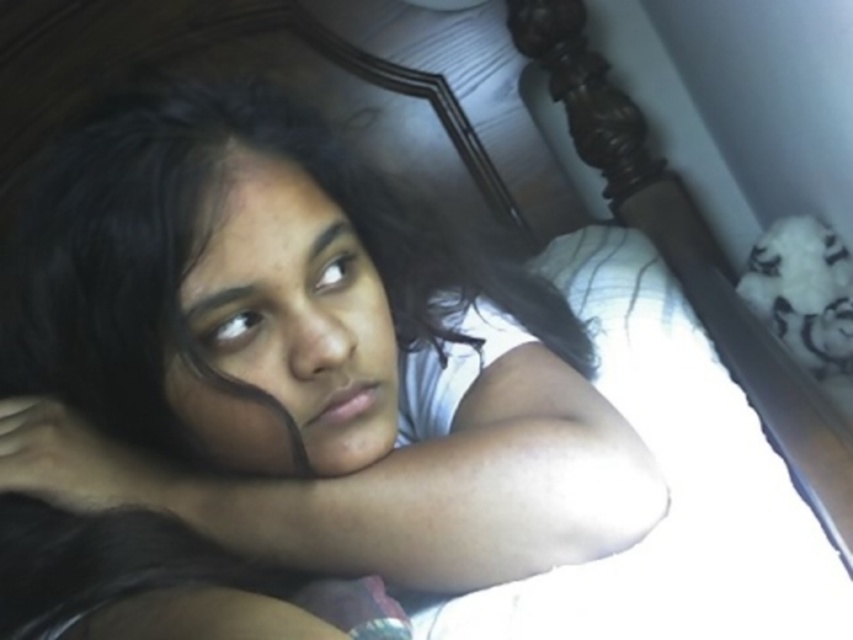
You are taking a photo of the scene and want to focus on both point (370, 620) and point (289, 264). Since the camera can only focus on one depth at a time, which point should you prioritize focusing on to ensure the closer one is sharp?

You should prioritize focusing on point (370, 620) because it is closer to the camera than point (289, 264), ensuring the closer point remains sharp.

You are a photographer setting up a shoot in the room described. You need to position a spotlight so it illuminates the smooth skin girl at center without affecting the background. Based on the coordinates provided, where should you aim the spotlight?

The smooth skin girl at center is located at point (283, 387), so aim the spotlight at those coordinates to focus on her without affecting the background.

You are a photographer standing in front of the smooth skin girl at center. You want to take a portrait photo of her. What is the minimum distance you should maintain to ensure the entire body is in frame?

The smooth skin girl at center and viewer are 12.89 inches apart from each other. To ensure the entire body is in frame, the photographer should maintain a distance of at least 12.89 inches.